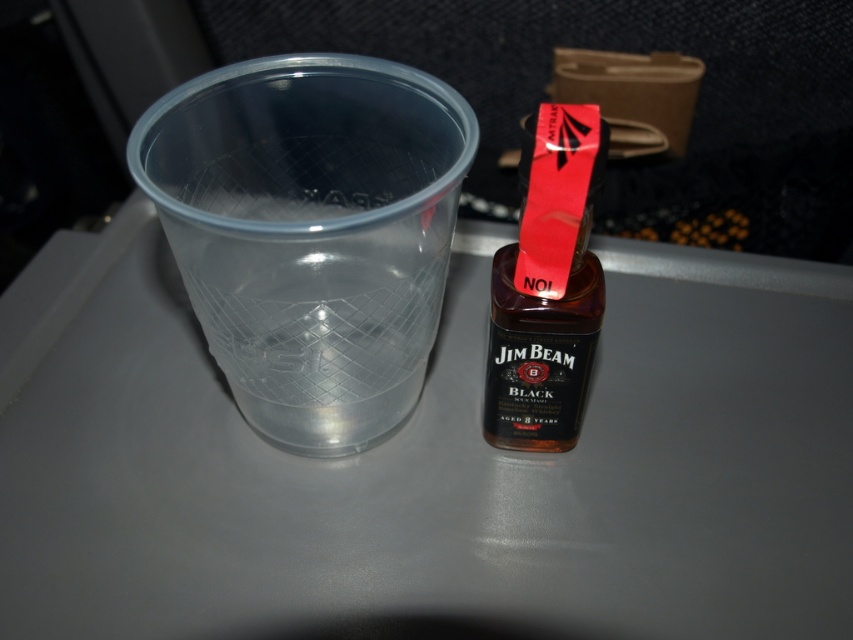
You are a flight attendant on an airplane. You need to place a glass of water next to the Jim Beam Black bourbon whiskey bottle on the tray table. The glass of water must be placed exactly where the transparent plastic cup at left was originally located. What are the coordinates where you should place the glass of water?

You should place the glass of water at the coordinates point (x=311, y=234) where the transparent plastic cup at left was originally located.

You are a flight attendant on an airplane. You need to place a drink order for a passenger who wants a glass of water. The tray table has limited space. The transparent plastic cup at left and the black glass jim beam bottle at center are already on the tray. Can you fit another small item, like a pack of nuts, between them without moving the existing items?

The distance between the transparent plastic cup at left and the black glass jim beam bottle at center is 7.24 inches. Since the tray table has limited space, a small item like a pack of nuts can likely fit in the 7.24 inch gap between them.

You are a flight attendant on an airplane. You have a transparent plastic cup at left and a black glass Jim Beam bottle at center on a tray table. A passenger asks if the cup can hold the entire contents of the bottle. Based on their sizes, what do you tell them?

The transparent plastic cup at left is larger in size compared to the black glass Jim Beam bottle at center, so it can potentially hold the entire contents of the bottle.